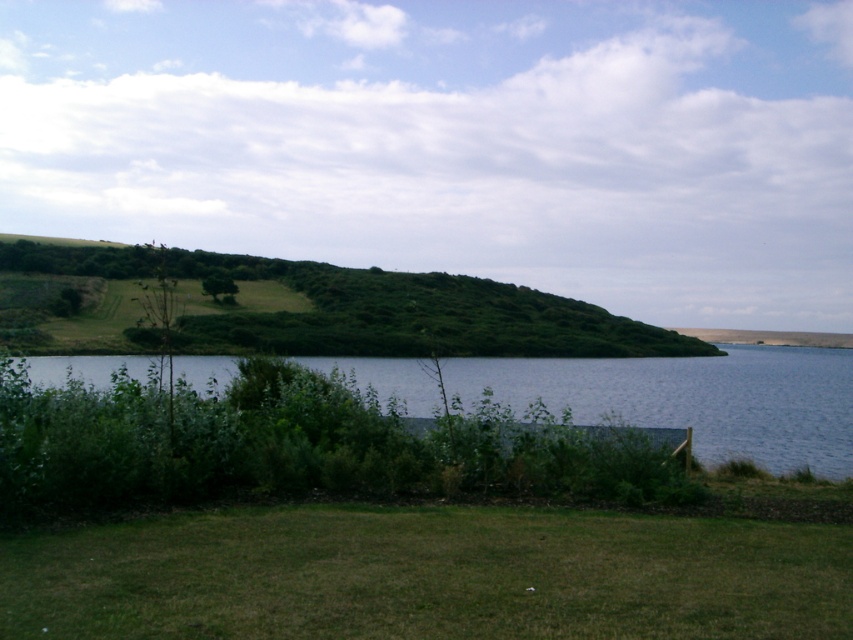
Question: Considering the relative positions of green grassy field at lower center and green grassy hillside at upper left in the image provided, where is green grassy field at lower center located with respect to green grassy hillside at upper left?

Choices:
 (A) left
 (B) right

Answer: (B)

Question: Which of these objects is positioned closest to the blue water at center?

Choices:
 (A) green grassy field at lower center
 (B) green grassy hillside at upper left

Answer: (B)

Question: Is green grassy field at lower center smaller than blue water at center?

Choices:
 (A) no
 (B) yes

Answer: (B)

Question: Which of the following is the farthest from the observer?

Choices:
 (A) (851, 356)
 (B) (659, 554)
 (C) (422, 333)

Answer: (A)

Question: Can you confirm if blue water at center is smaller than green grassy hillside at upper left?

Choices:
 (A) yes
 (B) no

Answer: (A)

Question: Estimate the real-world distances between objects in this image. Which object is farther from the green grassy field at lower center?

Choices:
 (A) blue water at center
 (B) green grassy hillside at upper left

Answer: (B)